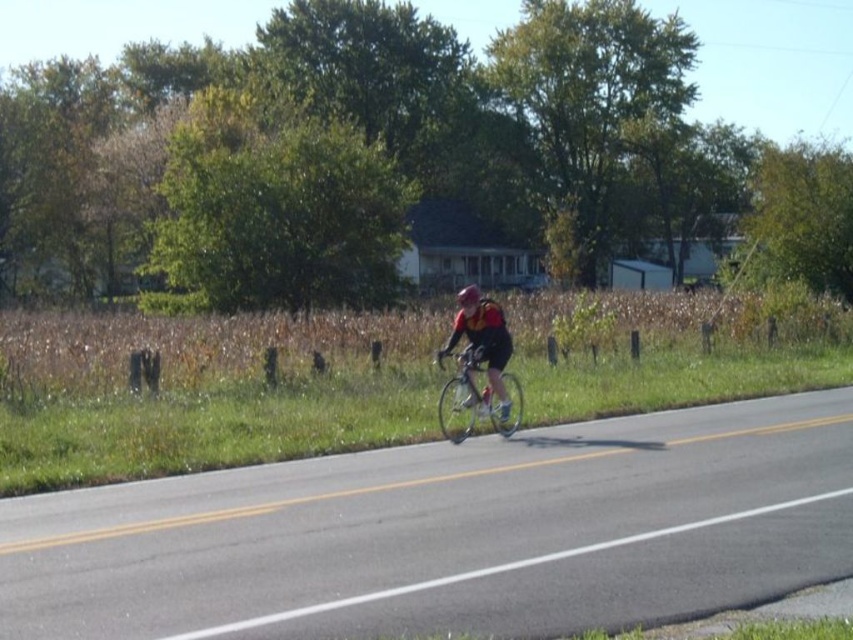
Question: Can you confirm if shiny metallic bicycle at center is wider than matte black helmet at center?

Choices:
 (A) no
 (B) yes

Answer: (A)

Question: Does shiny metallic bicycle at center have a lesser width compared to matte black cycling outfit at center?

Choices:
 (A) yes
 (B) no

Answer: (B)

Question: Which point is closer to the camera?

Choices:
 (A) (469, 292)
 (B) (502, 387)
 (C) (439, 396)

Answer: (A)

Question: Which of the following is the closest to the observer?

Choices:
 (A) (465, 358)
 (B) (500, 419)

Answer: (A)

Question: Which object appears farthest from the camera in this image?

Choices:
 (A) shiny metallic bicycle at center
 (B) matte black helmet at center
 (C) matte black cycling outfit at center

Answer: (B)

Question: In this image, where is shiny metallic bicycle at center located relative to matte black cycling outfit at center?

Choices:
 (A) above
 (B) below

Answer: (B)